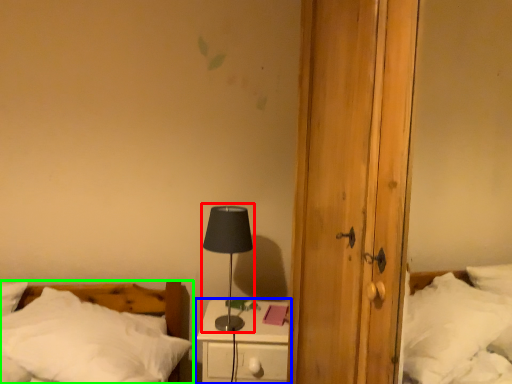
Question: Estimate the real-world distances between objects in this image. Which object is closer to table lamp (highlighted by a red box), nightstand (highlighted by a blue box) or bed (highlighted by a green box)?

Choices:
 (A) nightstand
 (B) bed

Answer: (A)